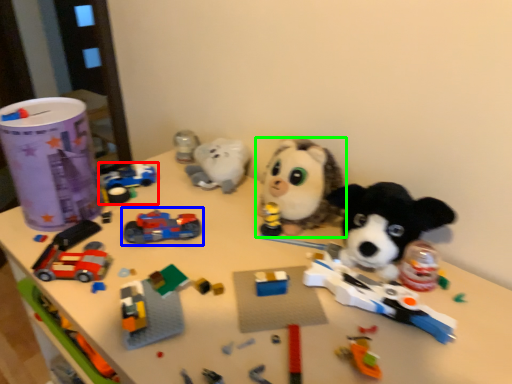
Question: Which object is positioned farthest from toy (highlighted by a red box)? Select from toy (highlighted by a blue box) and toy (highlighted by a green box).

Choices:
 (A) toy
 (B) toy

Answer: (B)